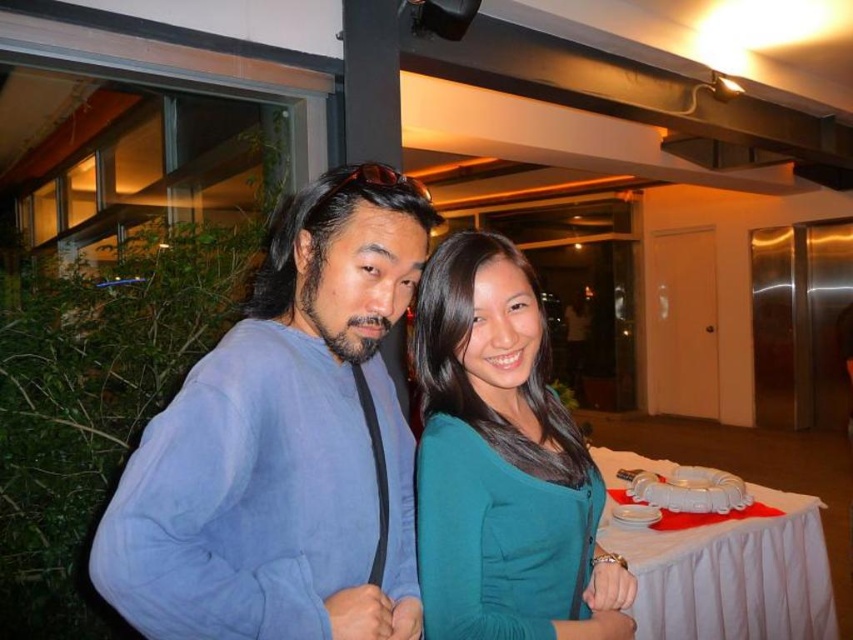
Question: Does blue fleece jacket at center appear under teal matte dress at center?

Choices:
 (A) yes
 (B) no

Answer: (B)

Question: Which of the following is the closest to the observer?

Choices:
 (A) white cloth-covered table at lower right
 (B) blue fleece jacket at center

Answer: (B)

Question: Estimate the real-world distances between objects in this image. Which object is closer to the teal matte dress at center?

Choices:
 (A) white cloth-covered table at lower right
 (B) blue fleece jacket at center

Answer: (B)

Question: Where is teal matte dress at center located in relation to white cloth-covered table at lower right in the image?

Choices:
 (A) below
 (B) above

Answer: (B)

Question: Does blue fleece jacket at center have a smaller size compared to white cloth-covered table at lower right?

Choices:
 (A) yes
 (B) no

Answer: (A)

Question: Estimate the real-world distances between objects in this image. Which object is farther from the teal matte dress at center?

Choices:
 (A) white cloth-covered table at lower right
 (B) blue fleece jacket at center

Answer: (A)